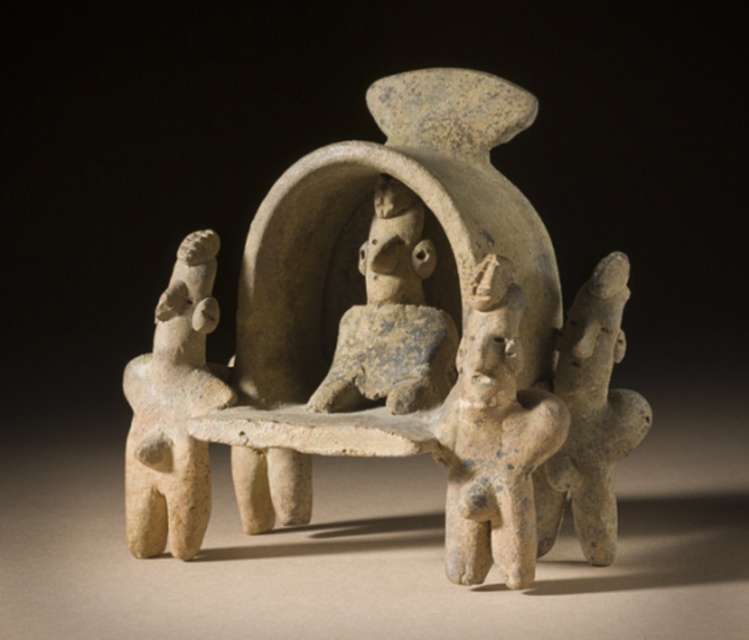
Question: Does speckled beige figurine at left come behind speckled clay figure at center?

Choices:
 (A) yes
 (B) no

Answer: (A)

Question: Does speckled beige figurine at left have a smaller size compared to gray stone figure at right?

Choices:
 (A) yes
 (B) no

Answer: (B)

Question: Estimate the real-world distances between objects in this image. Which object is farther from the speckled clay figure at center?

Choices:
 (A) speckled stone figure at center
 (B) gray stone figure at right

Answer: (B)

Question: Can you confirm if speckled clay figure at center is positioned to the left of gray stone figure at right?

Choices:
 (A) yes
 (B) no

Answer: (A)

Question: Which object is positioned closest to the gray stone figure at right?

Choices:
 (A) speckled stone figure at center
 (B) speckled clay figure at center

Answer: (A)

Question: Which object appears closest to the camera in this image?

Choices:
 (A) gray stone figure at right
 (B) speckled beige figurine at left
 (C) speckled stone figure at center

Answer: (C)